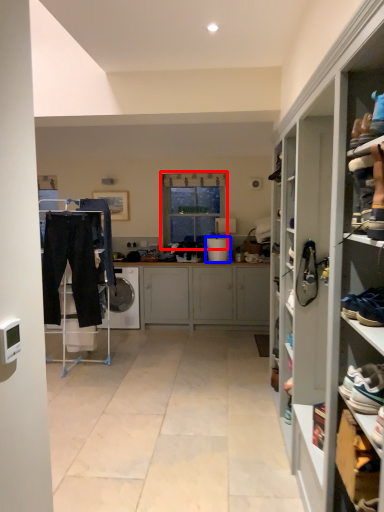
Question: Among these objects, which one is nearest to the camera, window (highlighted by a red box) or appliance (highlighted by a blue box)?

Choices:
 (A) window
 (B) appliance

Answer: (B)